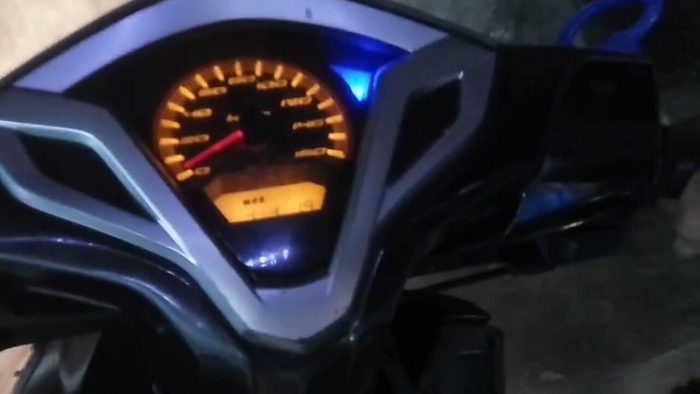
Locate an element on the screen. The width and height of the screenshot is (700, 394). gray panel is located at coordinates (290, 328).